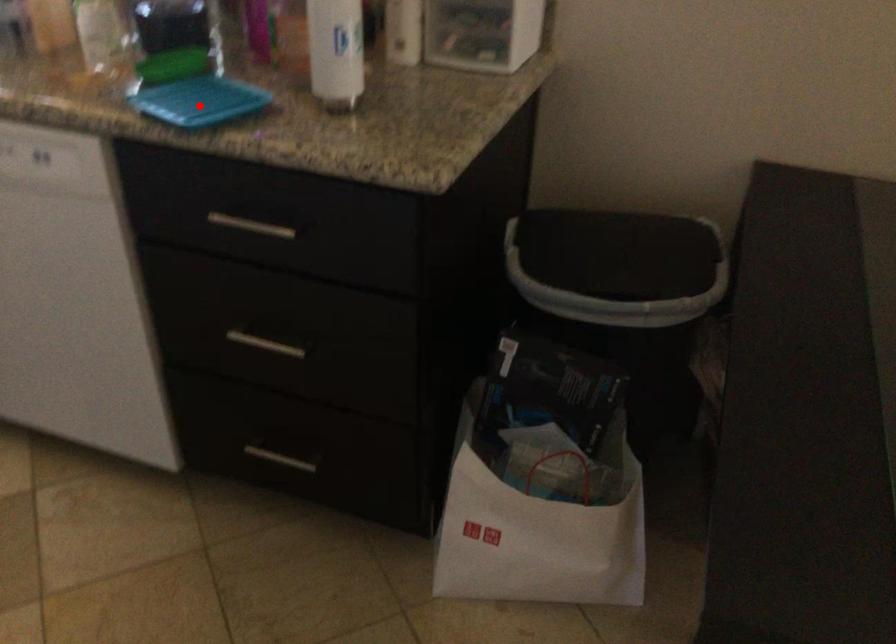
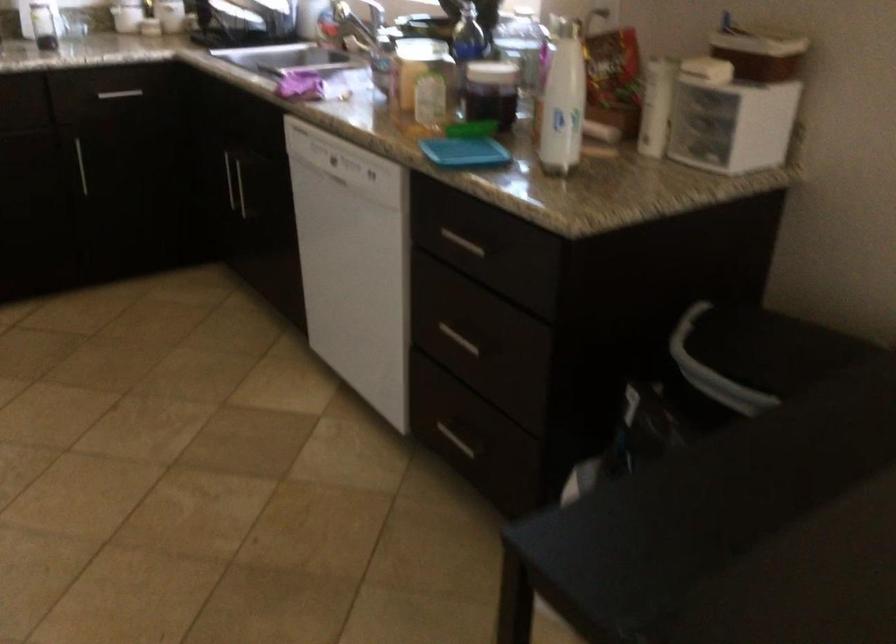
In the second image, find the point that corresponds to the highlighted location in the first image.

(464, 152)